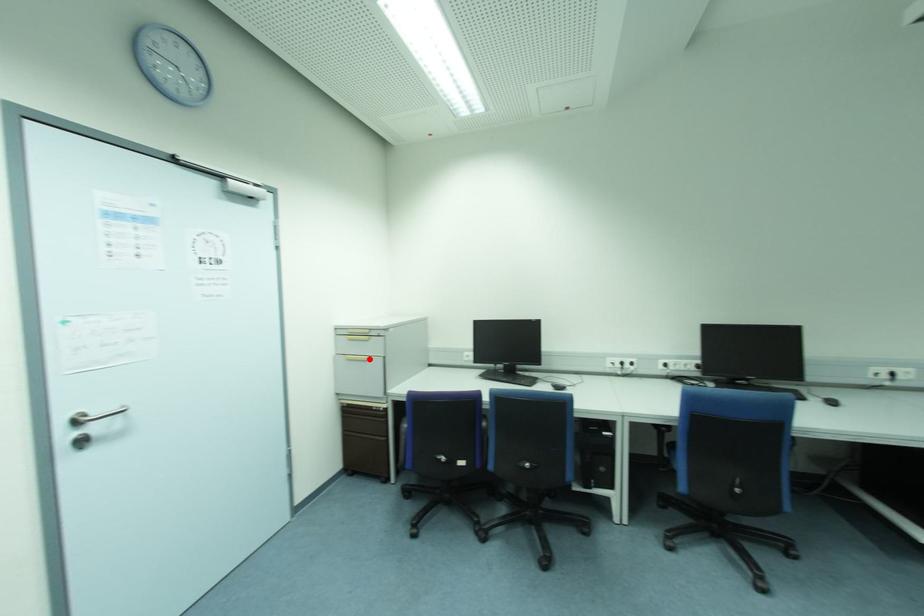
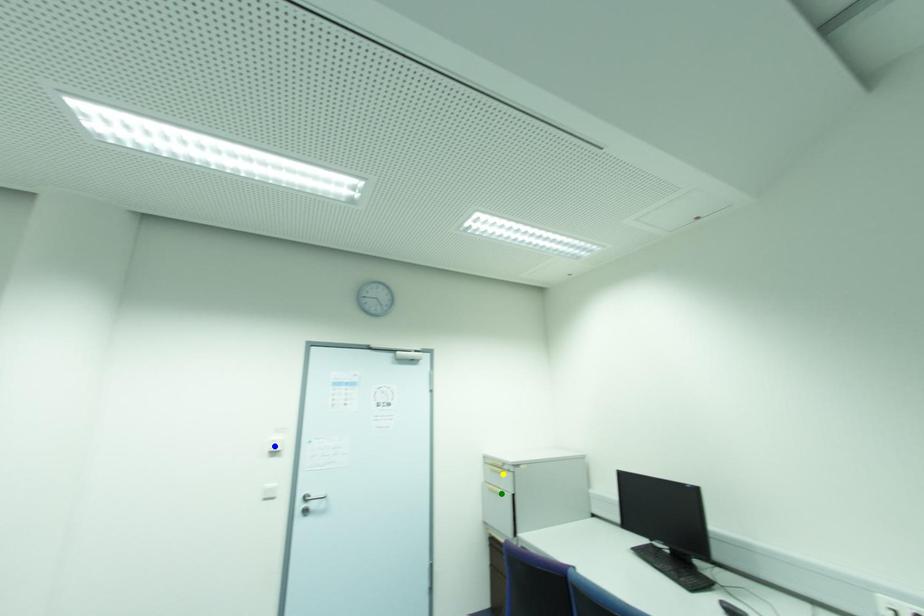
Question: I am providing you with two images of the same scene from different viewpoints. A red point is marked on the first image. You are given multiple points on the second image. In image 2, which mark is for the same physical point as the one in image 1?

Choices:
 (A) green point
 (B) blue point
 (C) yellow point

Answer: (A)